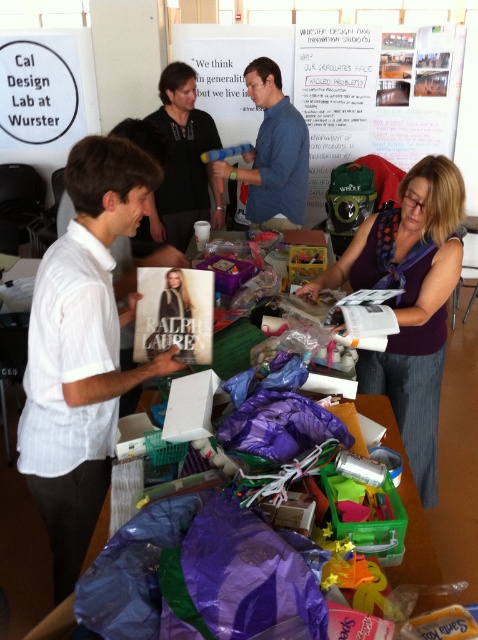
Can you confirm if purple plastic bag at center is bigger than blue cotton shirt at center?

Yes, purple plastic bag at center is bigger than blue cotton shirt at center.

Is point (348, 352) behind point (276, 122)?

No, it is not.

Find the location of a particular element. The width and height of the screenshot is (478, 640). purple plastic bag at center is located at coordinates (161, 445).

Which is more to the left, white striped shirt at left or blue cotton shirt at center?

From the viewer's perspective, white striped shirt at left appears more on the left side.

Is point (82, 433) closer to viewer compared to point (290, 172)?

Yes, it is in front of point (290, 172).

Locate an element on the screen. This screenshot has width=478, height=640. white striped shirt at left is located at coordinates (82, 349).

Which is below, purple fabric at center or blue cotton shirt at center?

purple fabric at center is lower down.

Identify the location of purple fabric at center. The image size is (478, 640). (410, 301).